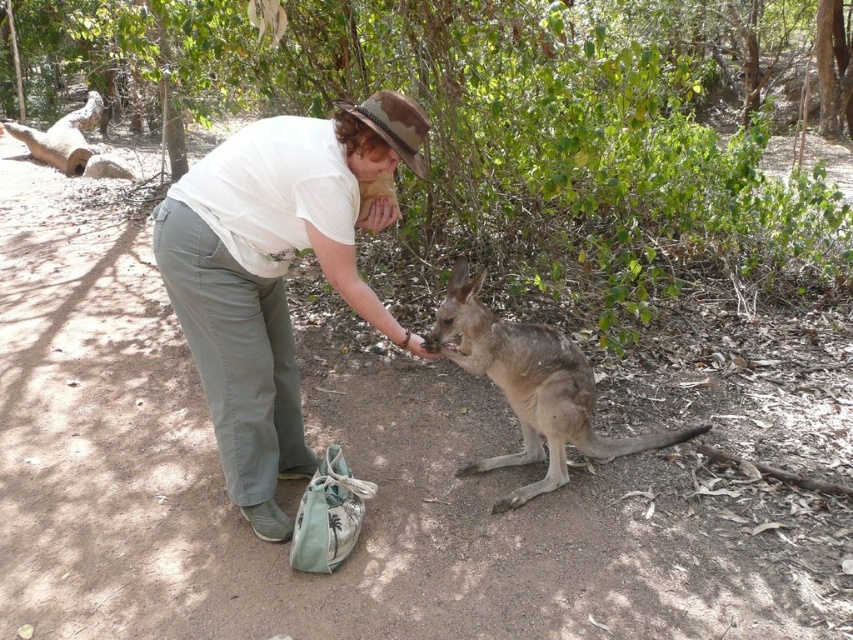
Measure the distance between point (x=344, y=177) and camera.

A distance of 8.16 feet exists between point (x=344, y=177) and camera.

Measure the distance from white cotton shirt at center to fur-covered kangaroo at center.

white cotton shirt at center and fur-covered kangaroo at center are 65.05 centimeters apart.

This screenshot has width=853, height=640. What are the coordinates of `white cotton shirt at center` in the screenshot? It's located at 276,272.